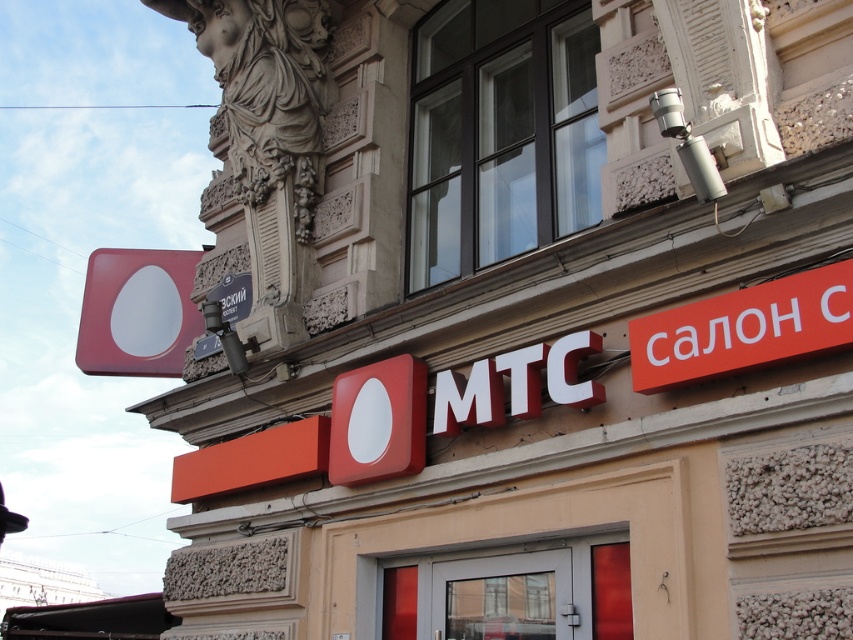
Is orange matte sign at upper right below matte red sign at upper left?

Indeed, orange matte sign at upper right is positioned under matte red sign at upper left.

Is orange matte sign at upper right shorter than matte red sign at upper left?

Indeed, orange matte sign at upper right has a lesser height compared to matte red sign at upper left.

What do you see at coordinates (743, 328) in the screenshot? This screenshot has width=853, height=640. I see `orange matte sign at upper right` at bounding box center [743, 328].

Locate an element on the screen. Image resolution: width=853 pixels, height=640 pixels. orange matte sign at upper right is located at coordinates (743, 328).

Does matte red sign at upper left have a smaller size compared to metallic gray sign at upper center?

Incorrect, matte red sign at upper left is not smaller in size than metallic gray sign at upper center.

Who is positioned more to the right, matte red sign at upper left or metallic gray sign at upper center?

From the viewer's perspective, metallic gray sign at upper center appears more on the right side.

Where is `matte red sign at upper left`? matte red sign at upper left is located at coordinates (137, 312).

Measure the distance between point (726, 339) and camera.

A distance of 65.16 feet exists between point (726, 339) and camera.

Which is more to the right, orange matte sign at upper right or metallic gray sign at upper center?

Positioned to the right is orange matte sign at upper right.

You are a GUI agent. You are given a task and a screenshot of the screen. Output one action in this format:
    pyautogui.click(x=<x>, y=<y>)
    Task: Click on the orange matte sign at upper right
    Image resolution: width=853 pixels, height=640 pixels.
    Given the screenshot: What is the action you would take?
    pyautogui.click(x=743, y=328)